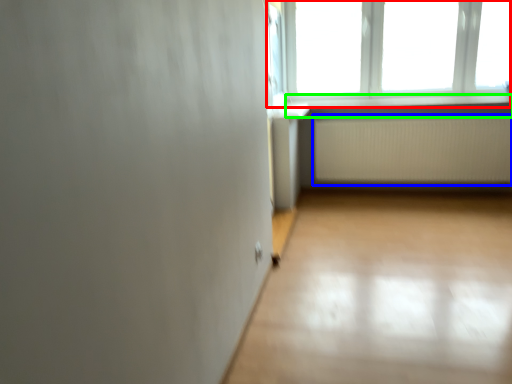
Question: Which object is the closest to the window (highlighted by a red box)? Choose among these: radiator (highlighted by a blue box) or window sill (highlighted by a green box).

Choices:
 (A) radiator
 (B) window sill

Answer: (B)